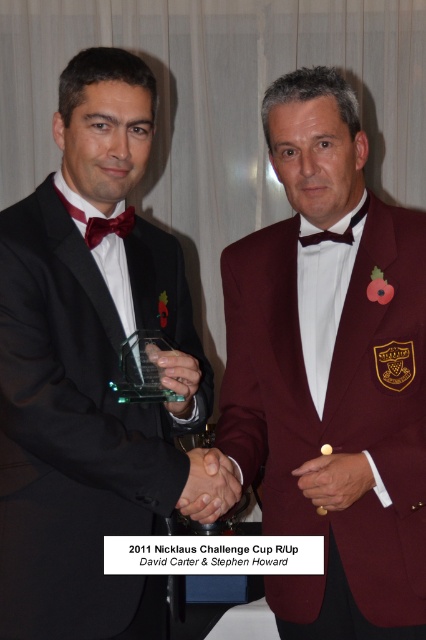
Question: Which object appears closest to the camera in this image?

Choices:
 (A) matte black tuxedo at left
 (B) maroon woolen blazer at center
 (C) matte red bow tie at left

Answer: (A)

Question: Is matte black tuxedo at left smaller than matte red bow tie at left?

Choices:
 (A) no
 (B) yes

Answer: (A)

Question: Which object is positioned closest to the matte red bow tie at left?

Choices:
 (A) matte black tuxedo at left
 (B) maroon woolen blazer at center

Answer: (A)

Question: Is matte black tuxedo at left below matte red bow tie at left?

Choices:
 (A) yes
 (B) no

Answer: (A)

Question: Among these objects, which one is nearest to the camera?

Choices:
 (A) matte black tuxedo at left
 (B) matte red bow tie at left
 (C) maroon woolen blazer at center

Answer: (A)

Question: Does maroon woolen blazer at center appear over matte black tuxedo at left?

Choices:
 (A) yes
 (B) no

Answer: (B)